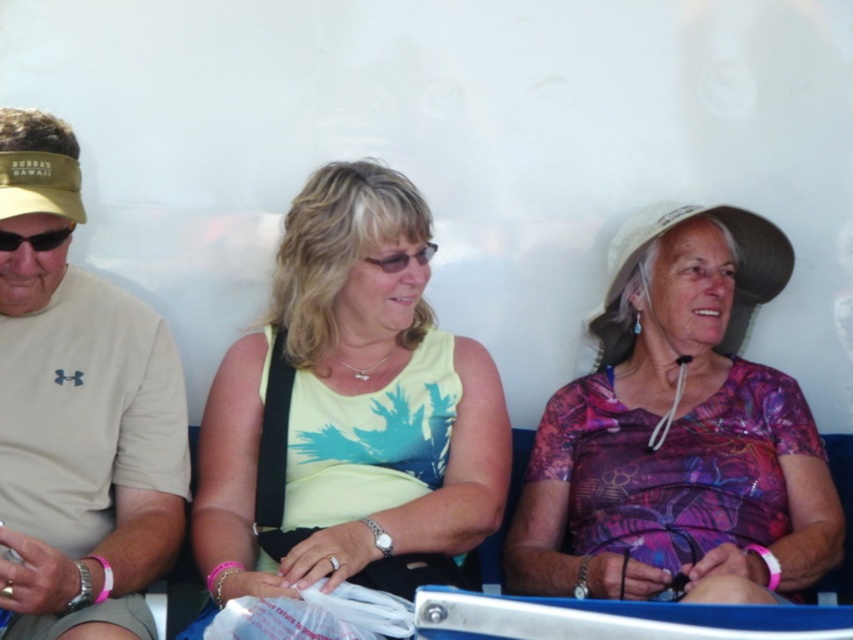
Can you confirm if black plastic sunglasses at left is positioned to the right of matte black glasses at center?

In fact, black plastic sunglasses at left is to the left of matte black glasses at center.

Is black plastic sunglasses at left wider than matte black glasses at center?

No.

Is point (50, 237) farther from camera compared to point (396, 260)?

No, it is in front of (396, 260).

This screenshot has width=853, height=640. Find the location of `black plastic sunglasses at left`. black plastic sunglasses at left is located at coordinates (35, 237).

Between tan fabric shirt at left and matte black glasses at center, which one is positioned lower?

tan fabric shirt at left is below.

Between point (55, 552) and point (427, 250), which one is positioned behind?

Positioned behind is point (427, 250).

Identify the location of tan fabric shirt at left. (84, 451).

Measure the distance between yellow fabric tank top at center and tan fabric shirt at left.

A distance of 13.06 inches exists between yellow fabric tank top at center and tan fabric shirt at left.

Does point (373, 212) lie behind point (154, 465)?

Yes, point (373, 212) is farther from viewer.

This screenshot has width=853, height=640. Identify the location of yellow fabric tank top at center. (347, 410).